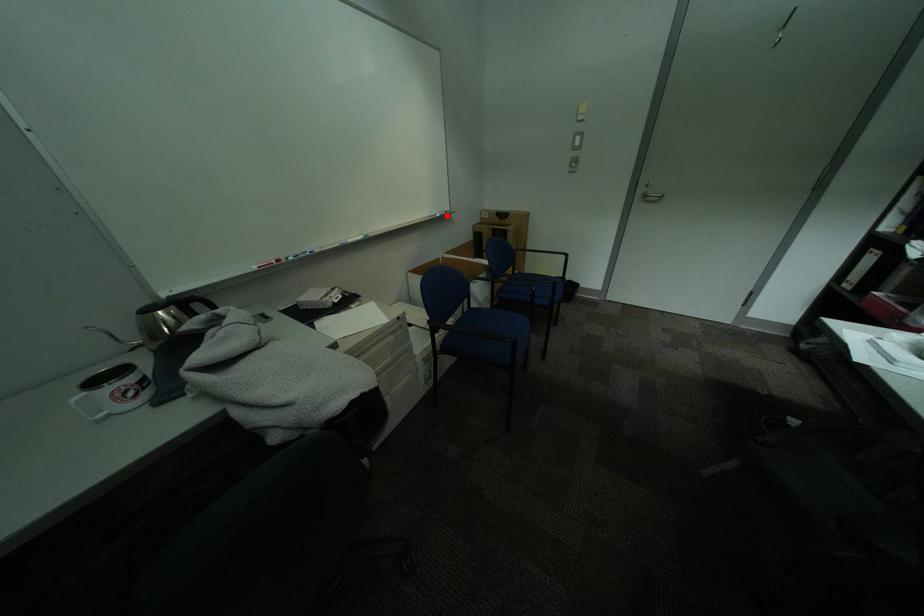
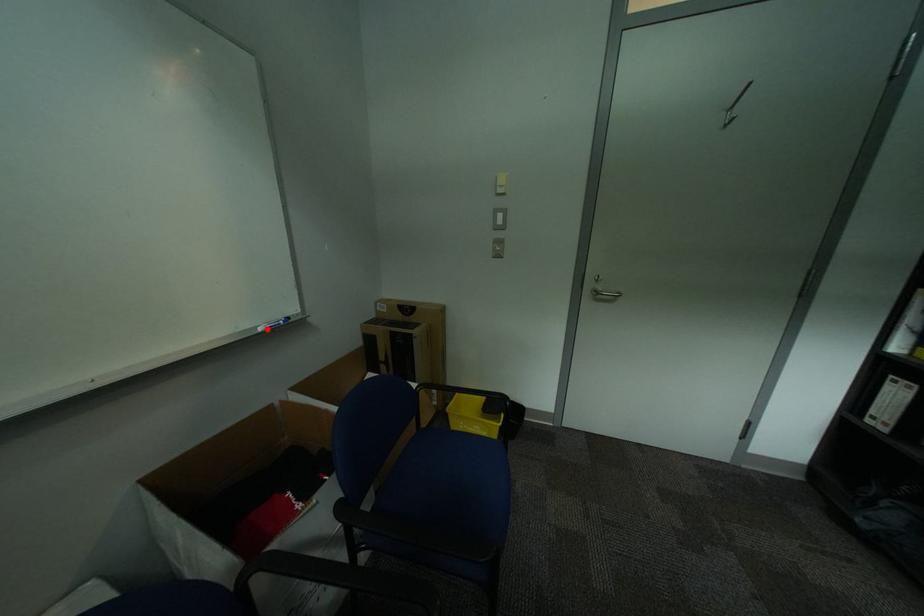
I am providing you with two images of the same scene from different viewpoints. A red point is marked on the first image and another point is marked on the second image. Do the highlighted points in image1 and image2 indicate the same real-world spot?

Yes